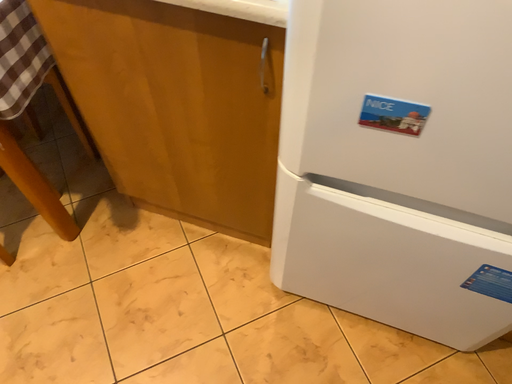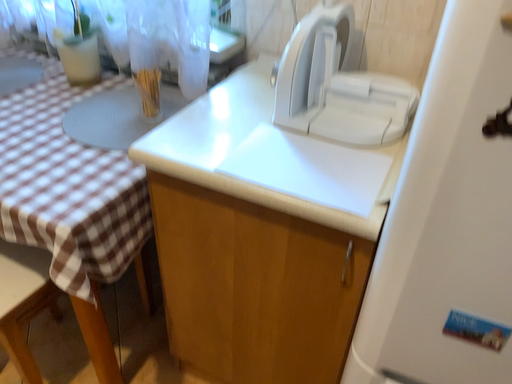
Question: Which way did the camera rotate in the video?

Choices:
 (A) rotated upward
 (B) rotated downward

Answer: (A)